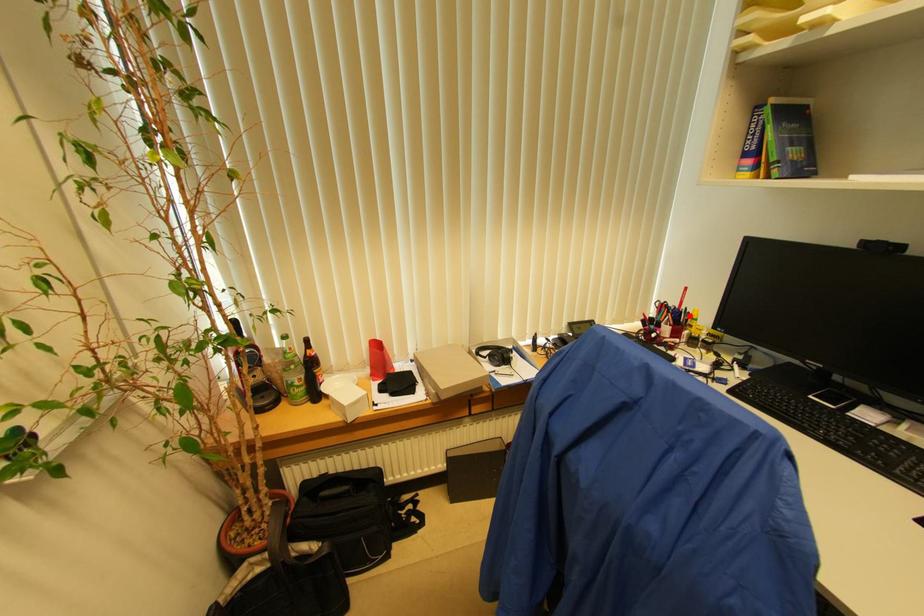
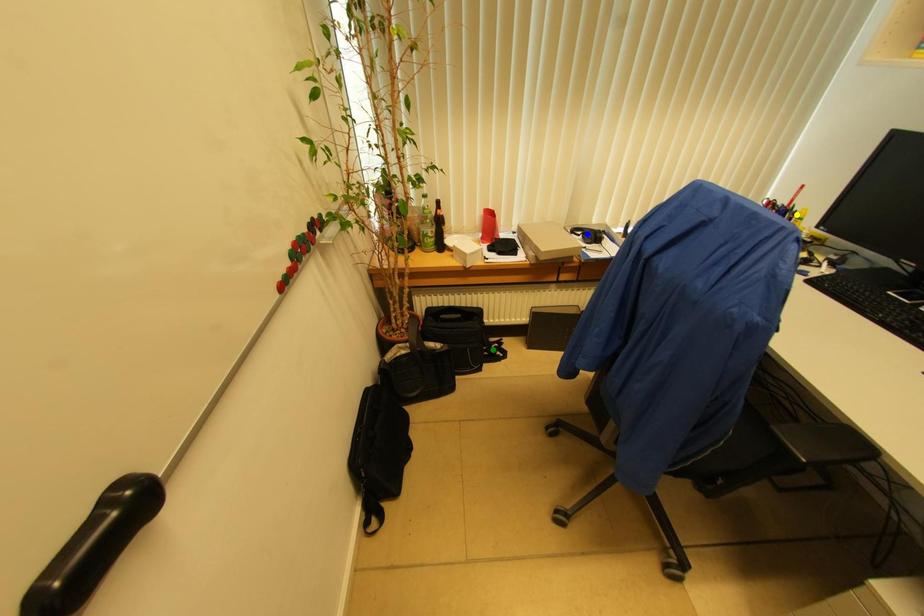
Question: I am providing you with two images of the same scene from different viewpoints. A red point is marked on the first image. You are given multiple points on the second image. Which point in image 2 represents the same 3d spot as the red point in image 1?

Choices:
 (A) yellow point
 (B) green point
 (C) blue point

Answer: (A)